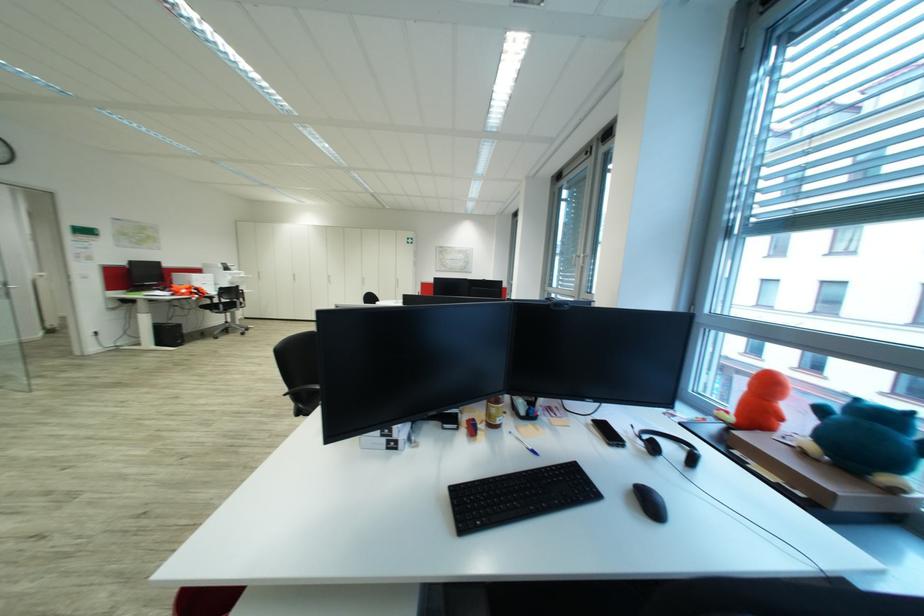
The location [666,445] corresponds to which object?

This point indicates the black headphones.